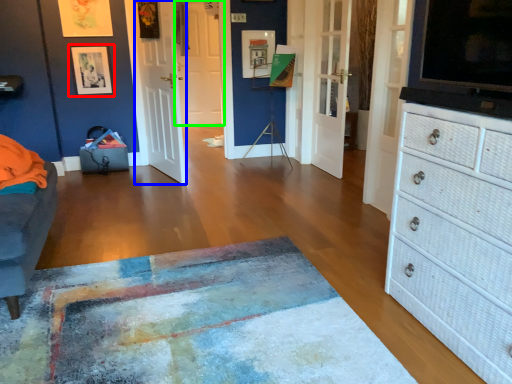
Question: Which object is the farthest from picture frame (highlighted by a red box)? Choose among these: door (highlighted by a blue box) or door (highlighted by a green box).

Choices:
 (A) door
 (B) door

Answer: (B)